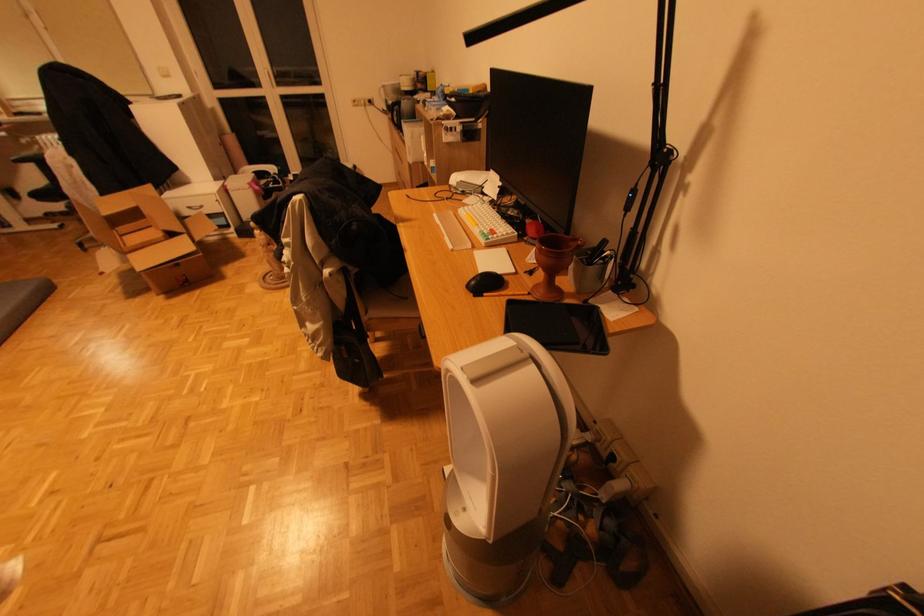
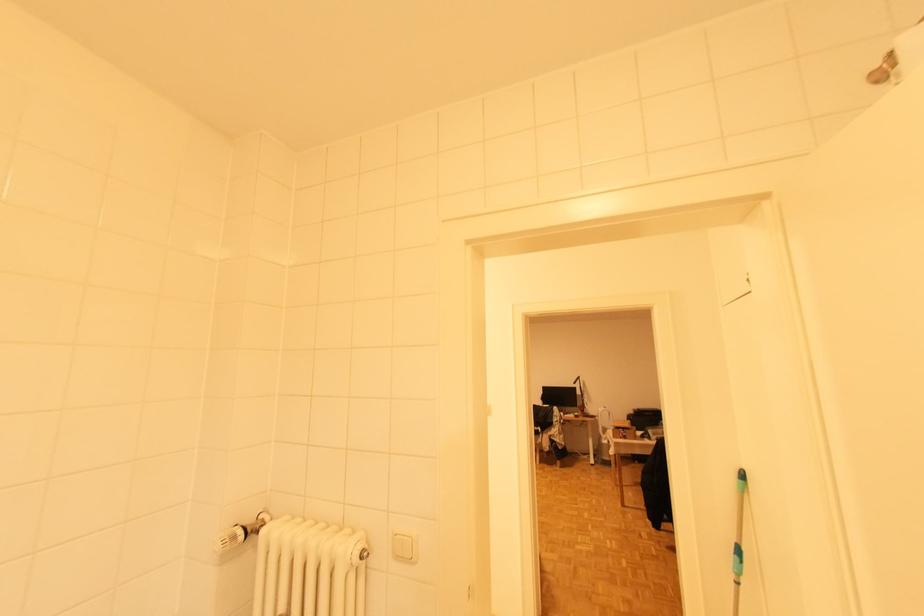
Question: I am providing you with two images of the same scene from different viewpoints. Please identify which objects are invisible in image2.

Choices:
 (A) white appliance dial
 (B) cardboard box flap
 (C) mop handle
 (D) radiator knob

Answer: (B)